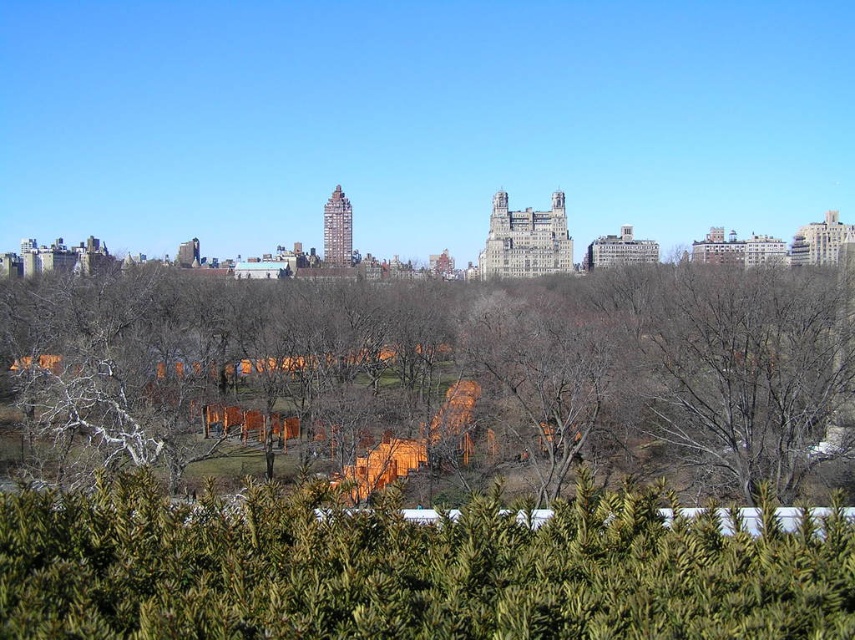
Question: Is brown wood fence at center below green textured hedge at lower center?

Choices:
 (A) yes
 (B) no

Answer: (B)

Question: Which of the following is the closest to the observer?

Choices:
 (A) (753, 285)
 (B) (104, 628)

Answer: (B)

Question: In this image, where is brown wood fence at center located relative to green textured hedge at lower center?

Choices:
 (A) right
 (B) left

Answer: (B)

Question: Which of the following is the closest to the observer?

Choices:
 (A) green textured hedge at lower center
 (B) brown wood fence at center

Answer: (A)

Question: Which object is farther from the camera taking this photo?

Choices:
 (A) brown wood fence at center
 (B) green textured hedge at lower center

Answer: (A)

Question: Can you confirm if brown wood fence at center is positioned to the left of green textured hedge at lower center?

Choices:
 (A) no
 (B) yes

Answer: (B)